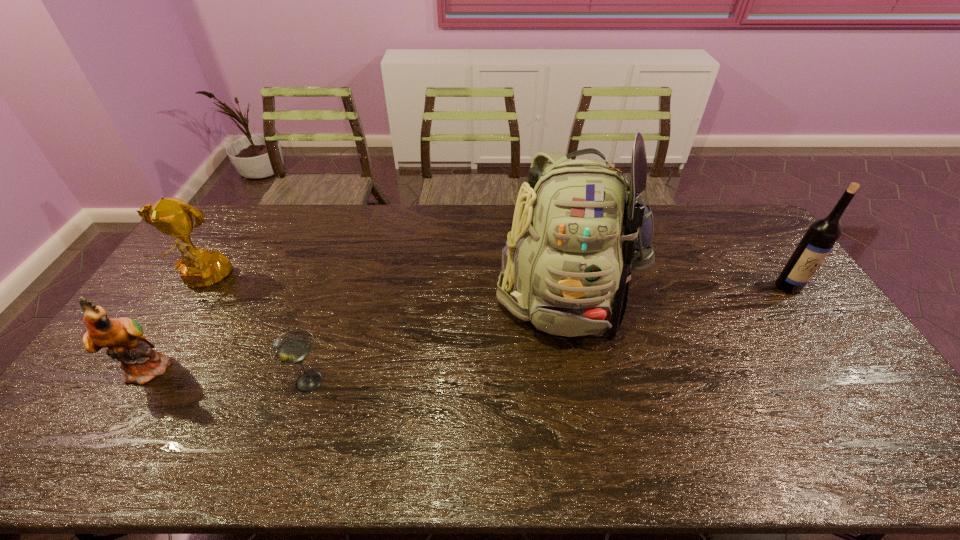
At what (x,y) coordinates should I click in order to perform the action: click on backpack. Please return your answer as a coordinate pair (x, y). Image resolution: width=960 pixels, height=540 pixels. Looking at the image, I should click on (579, 228).

This screenshot has height=540, width=960. I want to click on the second object from right to left, so click(x=579, y=228).

This screenshot has height=540, width=960. Find the location of `wine bottle`. wine bottle is located at coordinates (822, 234).

Find the location of a particular element. the rightmost object is located at coordinates (822, 234).

This screenshot has width=960, height=540. I want to click on award, so click(199, 268).

Find the location of a particular element. parrot is located at coordinates (123, 337).

This screenshot has width=960, height=540. What are the coordinates of `martini` in the screenshot? It's located at (293, 347).

You are a GUI agent. You are given a task and a screenshot of the screen. Output one action in this format:
    pyautogui.click(x=<x>, y=<y>)
    Task: Click on the third object from right to left
    This screenshot has height=540, width=960.
    Given the screenshot: What is the action you would take?
    pyautogui.click(x=293, y=347)

Identify the location of free space located 0.130m on the front-facing side of the tallest object. (584, 395).

This screenshot has height=540, width=960. Identify the location of free spot located 0.350m on the label of the wine bottle. (863, 393).